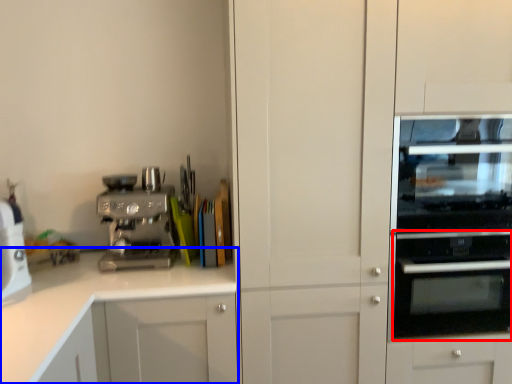
Question: Which point is closer to the camera, oven (highlighted by a red box) or cabinetry (highlighted by a blue box)?

Choices:
 (A) oven
 (B) cabinetry

Answer: (B)